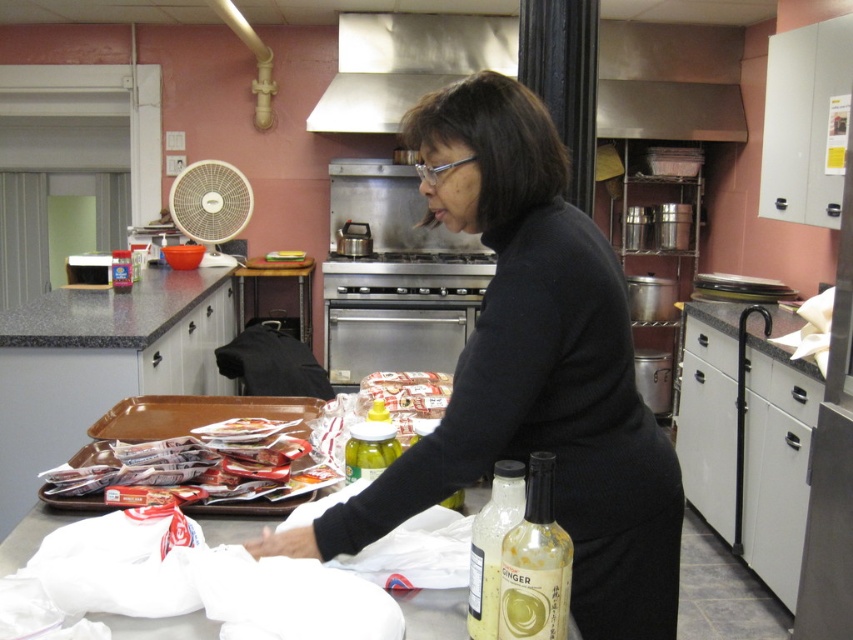
You are a delivery person who just arrived at the kitchen. You need to place a package that is 24 inches long on the counter between the black matte sweater at center and the shiny plastic tray at lower left. Is there enough space for the package?

The distance between the black matte sweater at center and the shiny plastic tray at lower left is 24.36 inches, which is slightly longer than the 24 inch package. Therefore, there is enough space to place the package between them.

You are a chef preparing a meal and need to place the translucent yellow glass ginger syrup at lower center onto the granite gray counter at center. Given that the syrup bottle is 10 inches tall, will it fit on the counter without falling off?

The distance between the granite gray counter at center and the translucent yellow glass ginger syrup at lower center is 8.20 feet. Since the syrup bottle is only 10 inches tall, it will not reach the counter when placed there. Therefore, it might not fit securely and could fall off.

You are a chef preparing a meal and need to place the translucent glass ginger syrup at center on a shelf that is the same height as the stainless steel exhaust hood at upper center. Is the ginger syrup too tall to fit on the shelf?

The stainless steel exhaust hood at upper center is much taller than the translucent glass ginger syrup at center, so the ginger syrup will fit on the shelf since it is shorter than the hood.